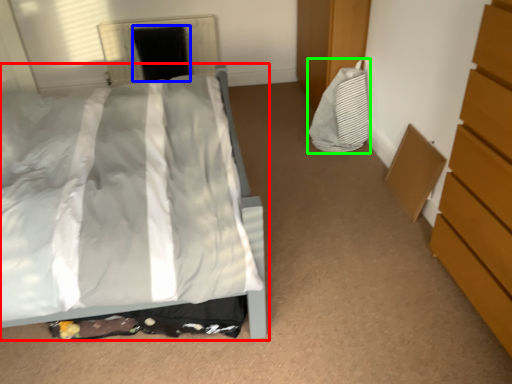
Question: Based on their relative distances, which object is farther from bed (highlighted by a red box)? Choose from screen door (highlighted by a blue box) and material (highlighted by a green box).

Choices:
 (A) screen door
 (B) material

Answer: (A)